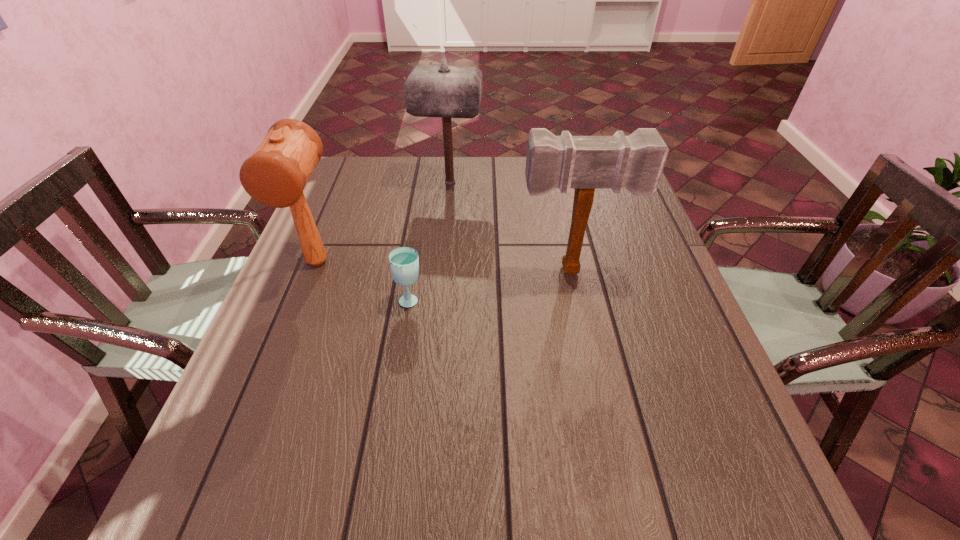
Find the location of `empty space between the rightmost mallet and the leftmost mallet`. empty space between the rightmost mallet and the leftmost mallet is located at coordinates (444, 266).

Find the location of a particular element. empty space between the leftmost object and the rightmost mallet is located at coordinates (444, 266).

I want to click on free area in between the farthest mallet and the rightmost mallet, so click(x=512, y=226).

I want to click on empty space that is in between the leftmost mallet and the nearest object, so click(364, 280).

This screenshot has height=540, width=960. I want to click on free space between the rightmost object and the second mallet from right to left, so click(x=512, y=226).

You are a GUI agent. You are given a task and a screenshot of the screen. Output one action in this format:
    pyautogui.click(x=<x>, y=<y>)
    Task: Click on the vacant space in between the rightmost object and the nearest object
    
    Given the screenshot: What is the action you would take?
    pyautogui.click(x=492, y=285)

The height and width of the screenshot is (540, 960). I want to click on vacant space that is in between the nearest object and the farthest mallet, so click(x=430, y=240).

The width and height of the screenshot is (960, 540). Find the location of `vacant point located between the rightmost mallet and the shortest object`. vacant point located between the rightmost mallet and the shortest object is located at coordinates (492, 285).

Where is `empty space that is in between the rightmost object and the leftmost mallet`? This screenshot has height=540, width=960. empty space that is in between the rightmost object and the leftmost mallet is located at coordinates (444, 266).

Choose which object is the second nearest neighbor to the leftmost object. Please provide its 2D coordinates. Your answer should be formatted as a tuple, i.e. [(x, y)], where the tuple contains the x and y coordinates of a point satisfying the conditions above.

[(444, 91)]